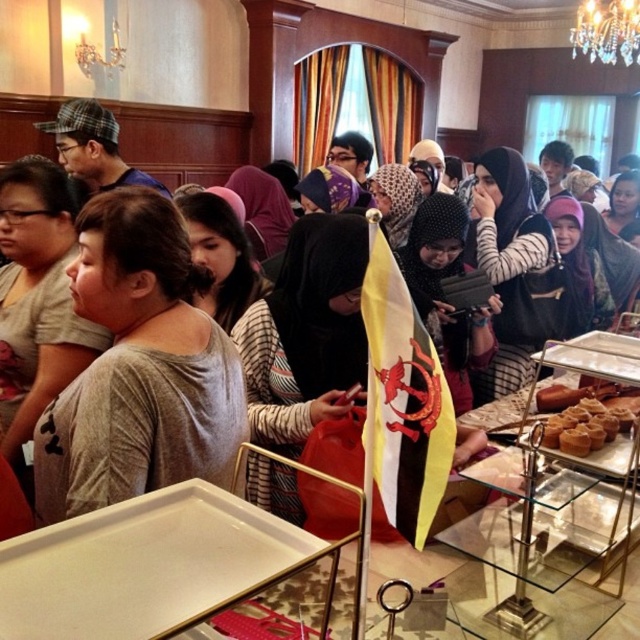
Question: Does gray matte shirt at center appear over matte black shirt at center?

Choices:
 (A) yes
 (B) no

Answer: (B)

Question: Among these points, which one is nearest to the camera?

Choices:
 (A) (38, 515)
 (B) (550, 396)
 (C) (212, 150)

Answer: (A)

Question: Which point is closer to the camera?

Choices:
 (A) (205, 406)
 (B) (608, 436)
 (C) (10, 152)

Answer: (A)

Question: Which object is positioned farthest from the golden brown pastry at lower right?

Choices:
 (A) gray matte shirt at center
 (B) matte black shirt at center

Answer: (B)

Question: Does gray matte shirt at center appear over golden brown pastry at lower right?

Choices:
 (A) yes
 (B) no

Answer: (A)

Question: Is gray matte shirt at center above golden brown pastry at lower right?

Choices:
 (A) yes
 (B) no

Answer: (A)